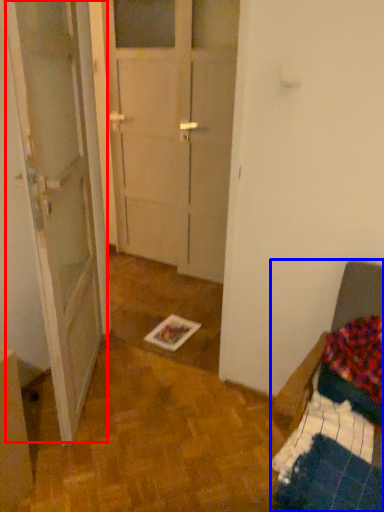
Question: Which point is further to the camera, barn door (highlighted by a red box) or furniture (highlighted by a blue box)?

Choices:
 (A) barn door
 (B) furniture

Answer: (A)